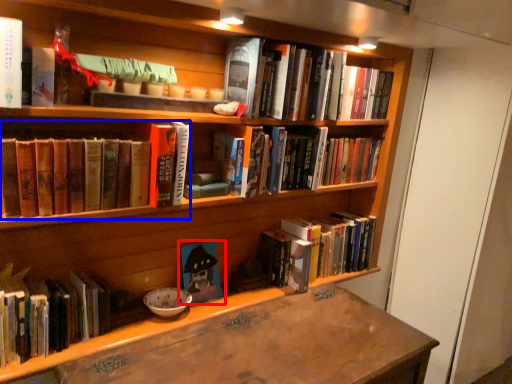
Question: Which object is closer to the camera taking this photo, book (highlighted by a red box) or book (highlighted by a blue box)?

Choices:
 (A) book
 (B) book

Answer: (B)